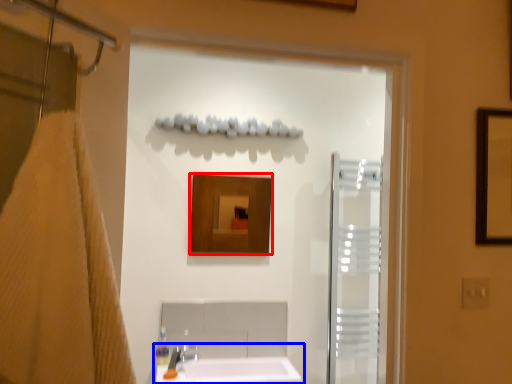
Question: Which of the following is the farthest to the observer, mirror (highlighted by a red box) or sink (highlighted by a blue box)?

Choices:
 (A) mirror
 (B) sink

Answer: (A)